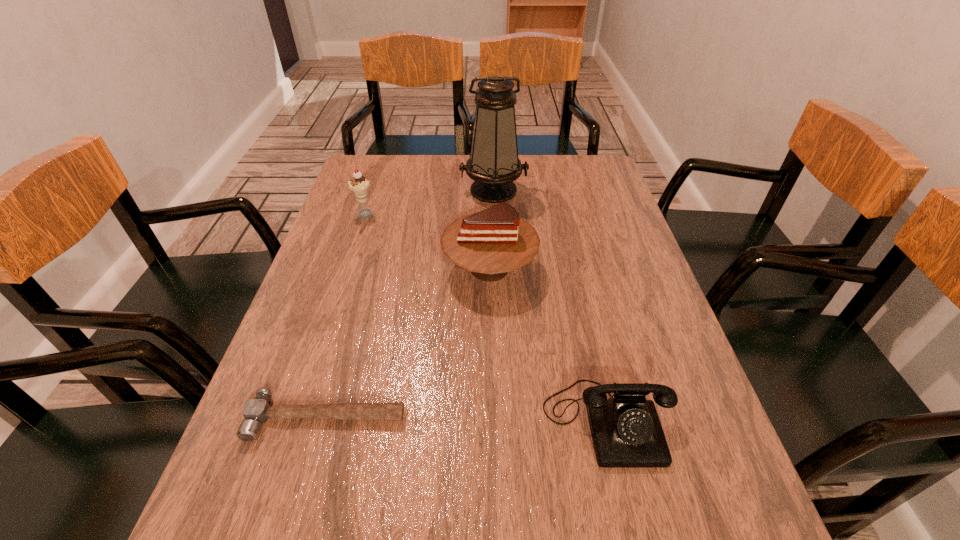
Locate an element on the screen. The image size is (960, 540). the tallest object is located at coordinates (493, 164).

The image size is (960, 540). Identify the location of oil lamp. (493, 164).

Locate an element on the screen. This screenshot has height=540, width=960. icecream is located at coordinates (358, 184).

The width and height of the screenshot is (960, 540). I want to click on cake, so pos(495,241).

Where is `telephone`? telephone is located at coordinates (626, 431).

Locate an element on the screen. hammer is located at coordinates (256, 411).

This screenshot has width=960, height=540. Find the location of `vacant space located on the back of the oil lamp`. vacant space located on the back of the oil lamp is located at coordinates (492, 156).

I want to click on vacant space located 0.390m on the right of the icecream, so click(x=510, y=215).

The width and height of the screenshot is (960, 540). Find the location of `free space located on the back of the third farthest object`. free space located on the back of the third farthest object is located at coordinates (488, 192).

This screenshot has width=960, height=540. I want to click on vacant area situated 0.060m on the front face of the second shortest object, so click(x=626, y=505).